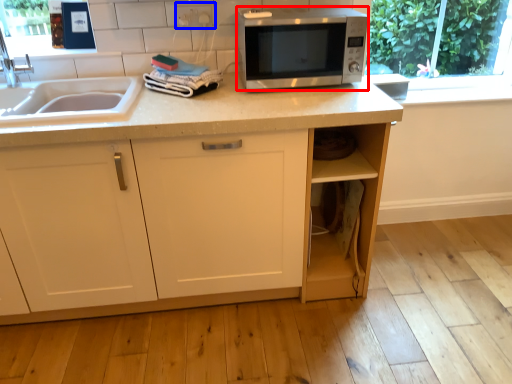
Question: Among these objects, which one is farthest to the camera, microwave oven (highlighted by a red box) or electric outlet (highlighted by a blue box)?

Choices:
 (A) microwave oven
 (B) electric outlet

Answer: (B)